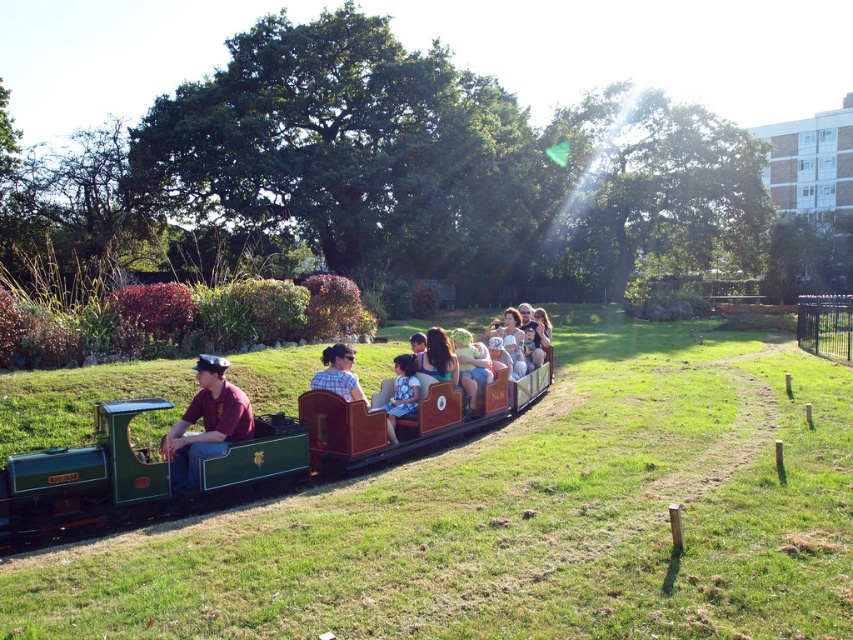
You are standing at the camera position and want to hand a souvenir to the person wearing the plaid shirt at center. Can you reach them without moving from your current position?

The plaid shirt at center is 24.38 feet away from the camera, so you cannot reach them without moving from your current position.

You are a photographer taking a picture of the plaid shirt at center and the blue floral dress at center. Which one will appear larger in the photo?

The plaid shirt at center will appear larger in the photo because it is closer to the viewer than the blue floral dress at center.